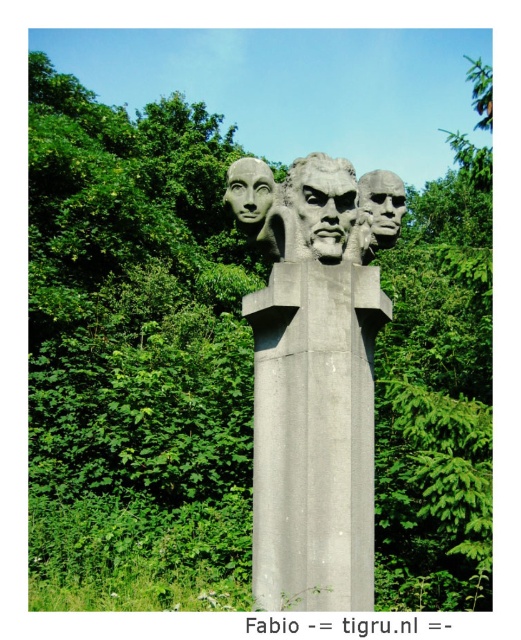
Is sculpted stone head at center taller than matte gray stone face at center?

Correct, sculpted stone head at center is much taller as matte gray stone face at center.

Which of these two, sculpted stone head at center or matte gray stone face at center, stands shorter?

With less height is matte gray stone face at center.

Identify the location of sculpted stone head at center. (321, 204).

The image size is (521, 640). What do you see at coordinates (381, 205) in the screenshot?
I see `matte gray face at center` at bounding box center [381, 205].

Measure the distance between point (365, 177) and camera.

Point (365, 177) and camera are 7.05 meters apart from each other.

You are a GUI agent. You are given a task and a screenshot of the screen. Output one action in this format:
    pyautogui.click(x=<x>, y=<y>)
    Task: Click on the matte gray face at center
    The height and width of the screenshot is (640, 521).
    Given the screenshot: What is the action you would take?
    pyautogui.click(x=381, y=205)

Where is `gray concrete pillar at center`? This screenshot has width=521, height=640. gray concrete pillar at center is located at coordinates (314, 435).

In order to click on gray concrete pillar at center in this screenshot , I will do `click(314, 435)`.